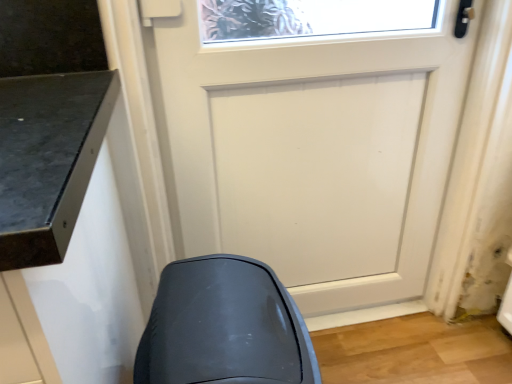
At what (x,y) coordinates should I click in order to perform the action: click on white matte door at center. Please return your answer as a coordinate pair (x, y). Looking at the image, I should click on (311, 152).

What do you see at coordinates (311, 152) in the screenshot?
I see `white matte door at center` at bounding box center [311, 152].

In order to face white matte door at center, should I rotate leftwards or rightwards?

To face it directly, rotate right by 8.657 degrees.

What do you see at coordinates (224, 327) in the screenshot? I see `matte gray swivel chair at lower left` at bounding box center [224, 327].

This screenshot has width=512, height=384. I want to click on matte gray swivel chair at lower left, so click(x=224, y=327).

In order to face matte gray swivel chair at lower left, should I rotate leftwards or rightwards?

Turn left approximately 1.077 degrees to face it.

I want to click on white matte door at center, so click(311, 152).

Between matte gray swivel chair at lower left and white matte door at center, which one appears on the left side from the viewer's perspective?

matte gray swivel chair at lower left is more to the left.

Based on the photo, who is more distant, matte gray swivel chair at lower left or white matte door at center?

white matte door at center is more distant.

Is point (301, 320) closer to camera compared to point (378, 78)?

Yes, it is.

In the scene shown: From the image's perspective, which one is positioned higher, matte gray swivel chair at lower left or white matte door at center?

white matte door at center, from the image's perspective.

From a real-world perspective, is matte gray swivel chair at lower left positioned under white matte door at center based on gravity?

Yes.

Considering the sizes of objects matte gray swivel chair at lower left and white matte door at center in the image provided, who is thinner, matte gray swivel chair at lower left or white matte door at center?

white matte door at center.

Considering the relative sizes of matte gray swivel chair at lower left and white matte door at center in the image provided, is matte gray swivel chair at lower left taller than white matte door at center?

Incorrect, the height of matte gray swivel chair at lower left is not larger of that of white matte door at center.

Is matte gray swivel chair at lower left smaller than white matte door at center?

Correct, matte gray swivel chair at lower left occupies less space than white matte door at center.

In the scene shown: Is matte gray swivel chair at lower left inside the boundaries of white matte door at center, or outside?

matte gray swivel chair at lower left lies outside white matte door at center.

Looking at this image, are matte gray swivel chair at lower left and white matte door at center far apart?

No, matte gray swivel chair at lower left is not far from white matte door at center.

Is matte gray swivel chair at lower left turned away from white matte door at center?

No, matte gray swivel chair at lower left is not facing the opposite direction of white matte door at center.

Can you tell me how much matte gray swivel chair at lower left and white matte door at center differ in facing direction?

They differ by 88.7 degrees in their facing directions.

Measure the distance between matte gray swivel chair at lower left and white matte door at center.

A distance of 51.75 centimeters exists between matte gray swivel chair at lower left and white matte door at center.

This screenshot has height=384, width=512. What are the coordinates of `swivel chair that appears on the left of white matte door at center` in the screenshot? It's located at pos(224,327).

Considering the relative positions of white matte door at center and matte gray swivel chair at lower left in the image provided, is white matte door at center to the left of matte gray swivel chair at lower left from the viewer's perspective?

In fact, white matte door at center is to the right of matte gray swivel chair at lower left.

Between white matte door at center and matte gray swivel chair at lower left, which one is positioned in front?

Positioned in front is matte gray swivel chair at lower left.

Is point (288, 272) more distant than point (252, 365)?

That is True.

From the image's perspective, is white matte door at center over matte gray swivel chair at lower left?

Yes.

From a real-world perspective, is white matte door at center above or below matte gray swivel chair at lower left?

In terms of real-world spatial position, white matte door at center is above matte gray swivel chair at lower left.

Considering the sizes of objects white matte door at center and matte gray swivel chair at lower left in the image provided, who is wider, white matte door at center or matte gray swivel chair at lower left?

matte gray swivel chair at lower left is wider.

Based on the photo, considering the relative sizes of white matte door at center and matte gray swivel chair at lower left in the image provided, is white matte door at center shorter than matte gray swivel chair at lower left?

No, white matte door at center is not shorter than matte gray swivel chair at lower left.

Considering the sizes of objects white matte door at center and matte gray swivel chair at lower left in the image provided, who is bigger, white matte door at center or matte gray swivel chair at lower left?

white matte door at center is bigger.

Can matte gray swivel chair at lower left be found inside white matte door at center?

Actually, matte gray swivel chair at lower left is outside white matte door at center.

In the scene shown: Is white matte door at center far away from matte gray swivel chair at lower left?

Actually, white matte door at center and matte gray swivel chair at lower left are a little close together.

Is white matte door at center facing away from matte gray swivel chair at lower left?

No, matte gray swivel chair at lower left is not at the back of white matte door at center.

How different are the orientations of white matte door at center and matte gray swivel chair at lower left in degrees?

white matte door at center and matte gray swivel chair at lower left are facing 88.7 degrees away from each other.

There is a matte gray swivel chair at lower left. At what (x,y) coordinates should I click in order to perform the action: click on door above it (from a real-world perspective). Please return your answer as a coordinate pair (x, y). The height and width of the screenshot is (384, 512). Looking at the image, I should click on (311, 152).

At what (x,y) coordinates should I click in order to perform the action: click on door above the matte gray swivel chair at lower left (from the image's perspective). Please return your answer as a coordinate pair (x, y). Looking at the image, I should click on (311, 152).

I want to click on door that appears above the matte gray swivel chair at lower left (from a real-world perspective), so click(311, 152).